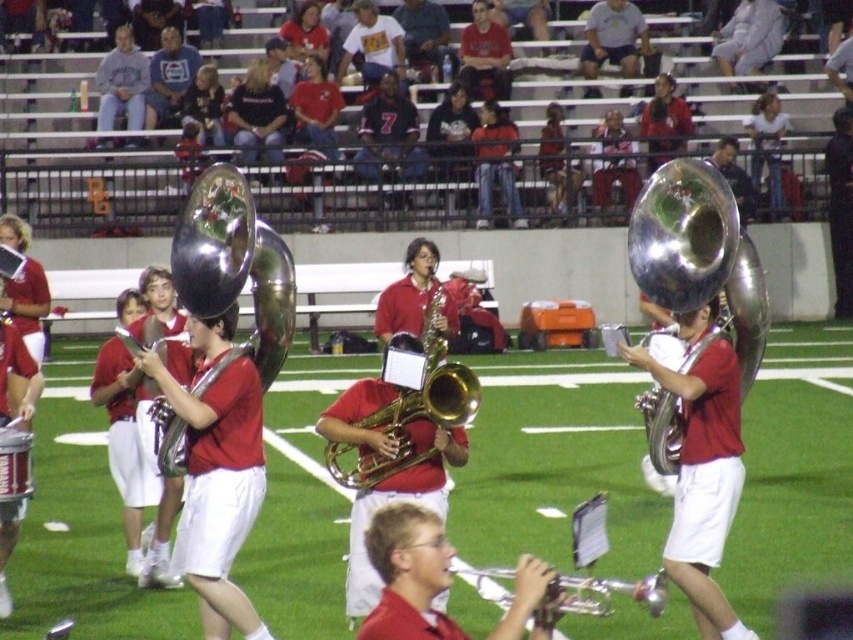
You are a photographer trying to capture a closeup of both the shiny brass trumpet at center and the gold brass trumpet at center. Which trumpet should you zoom in on more to ensure both are in focus?

The shiny brass trumpet at center is thinner than the gold brass trumpet at center, so you should zoom in more on the gold brass trumpet at center to ensure both are in focus.